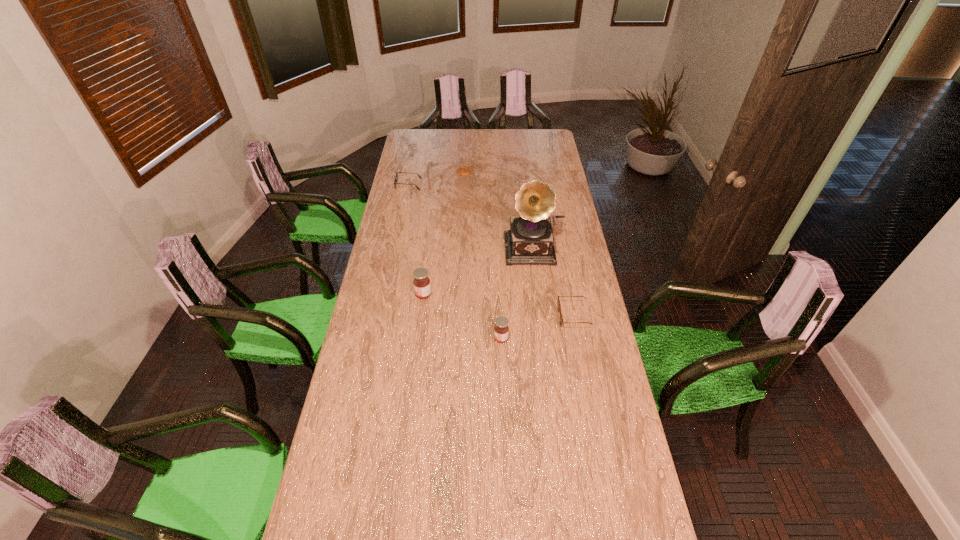
Where is `free space located on the horn of the third farthest object`? This screenshot has height=540, width=960. free space located on the horn of the third farthest object is located at coordinates (542, 303).

Locate an element on the screen. vacant space located 0.160m at the front view of the right spectacles is located at coordinates (517, 316).

Find the location of a particular element. This screenshot has width=960, height=540. free region located at the front view of the right spectacles is located at coordinates (497, 316).

Identify the location of free space located at the front view of the right spectacles. This screenshot has height=540, width=960. (497, 316).

You are a GUI agent. You are given a task and a screenshot of the screen. Output one action in this format:
    pyautogui.click(x=<x>, y=<y>)
    Task: Click on the object present at the left edge
    
    Given the screenshot: What is the action you would take?
    pyautogui.click(x=397, y=172)

Locate an element on the screen. The height and width of the screenshot is (540, 960). record player that is at the right edge is located at coordinates (530, 239).

The image size is (960, 540). I want to click on spectacles situated at the right edge, so click(558, 301).

Locate an element on the screen. free space at the far edge of the desktop is located at coordinates [x=497, y=132].

Find the location of a particular element. Image resolution: width=960 pixels, height=540 pixels. vacant space at the left edge of the desktop is located at coordinates (399, 265).

Where is `free space at the right edge of the desktop`? The width and height of the screenshot is (960, 540). free space at the right edge of the desktop is located at coordinates click(564, 262).